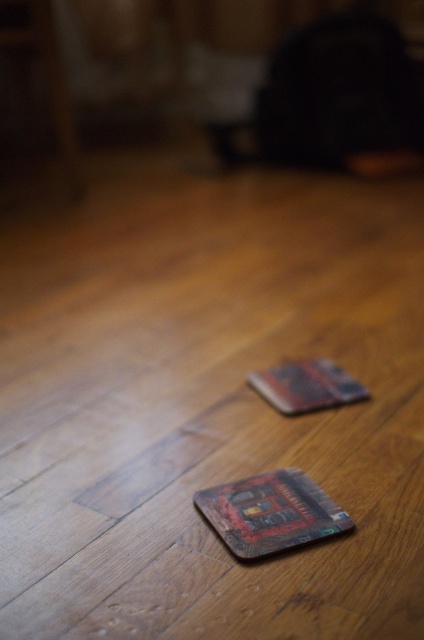
Question: Which point is closer to the camera?

Choices:
 (A) (306, 486)
 (B) (314, 410)

Answer: (A)

Question: Where is wooden coaster at center located in relation to wooden textured card at center in the image?

Choices:
 (A) left
 (B) right

Answer: (A)

Question: Can you confirm if wooden coaster at center is positioned to the right of wooden textured card at center?

Choices:
 (A) no
 (B) yes

Answer: (A)

Question: Does wooden coaster at center appear on the left side of wooden textured card at center?

Choices:
 (A) no
 (B) yes

Answer: (B)